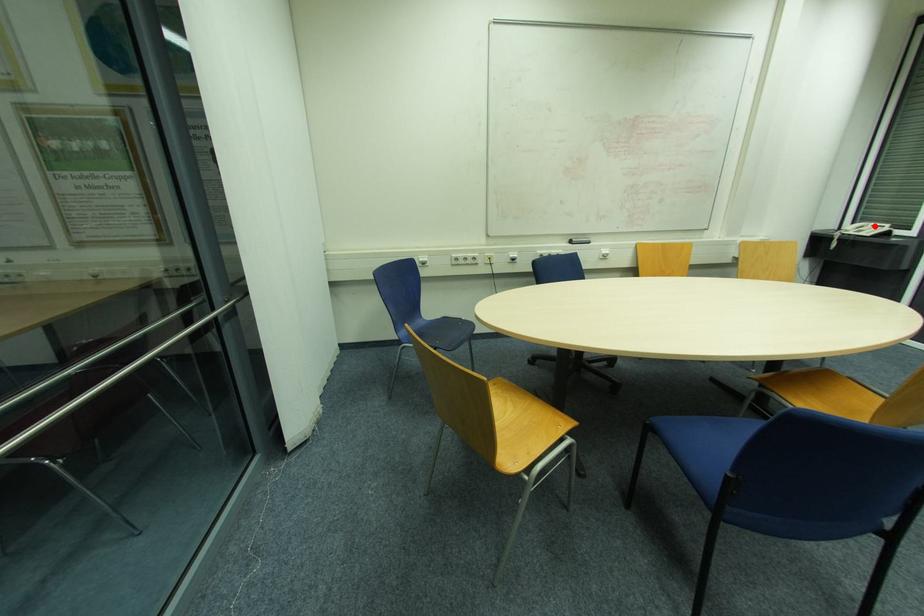
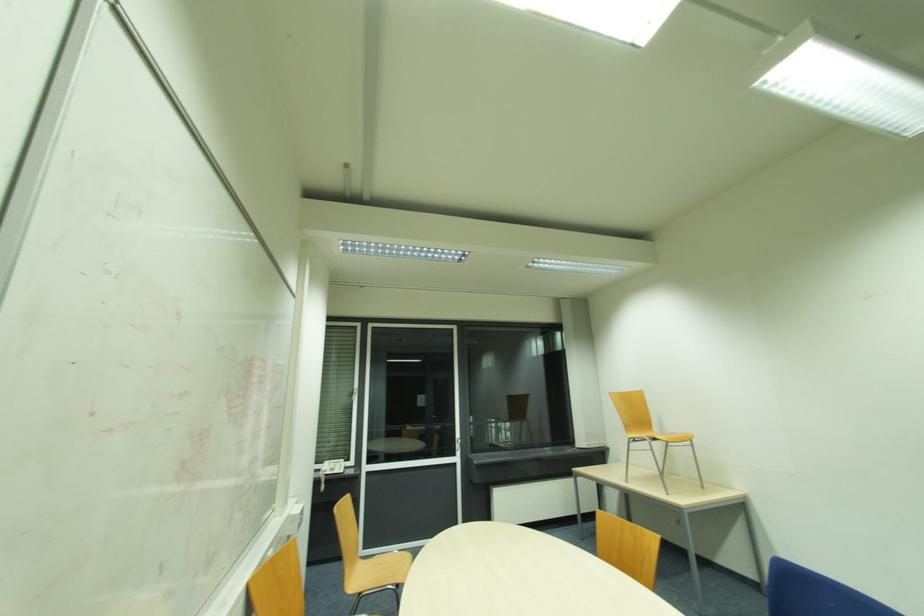
Where in the second image is the point corresponding to the highlighted location from the first image?

(334, 463)